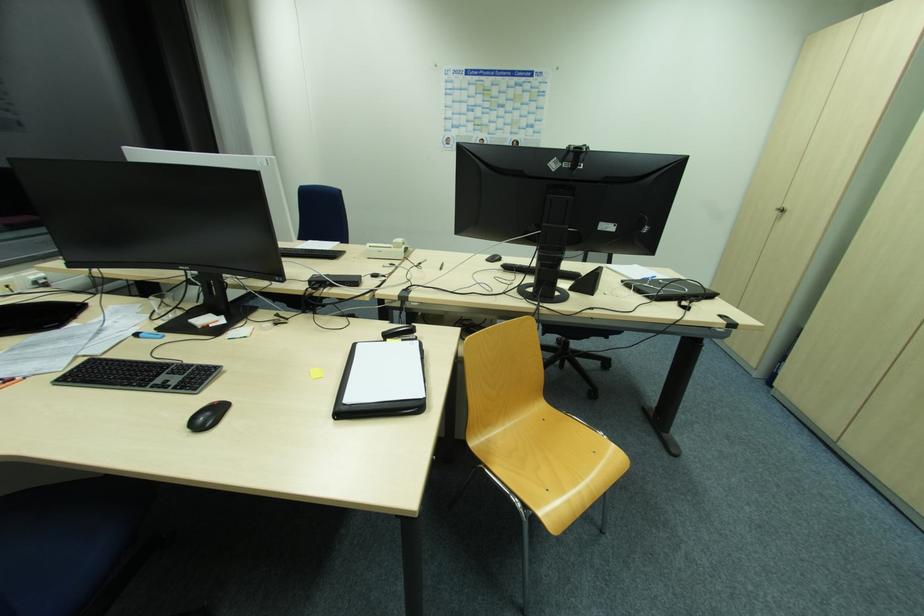
Where would you open the black clipboard? Please return your answer as a coordinate pair (x, y).

(382, 379)